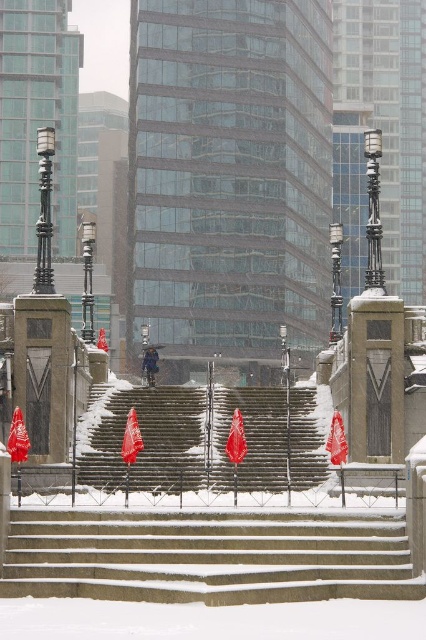
Does point (114, 484) lie in front of point (155, 364)?

Yes, point (114, 484) is closer to viewer.

Which of these two, snow-covered stone stairs at center or white snowsuit at center, stands shorter?

white snowsuit at center

Who is more forward, [169,458] or [146,358]?

Positioned in front is point [169,458].

The height and width of the screenshot is (640, 426). I want to click on snow-covered stone stairs at center, so click(x=149, y=440).

Who is lower down, snow-covered concrete stairs at lower center or white snowsuit at center?

Positioned lower is snow-covered concrete stairs at lower center.

Between point (336, 529) and point (146, 362), which one is positioned in front?

Point (336, 529)

Identify the location of snow-covered concrete stairs at lower center. This screenshot has width=426, height=640. (207, 556).

Is snow-covered concrete stairs at lower center above snow-covered stone stairs at center?

No.

Between point (270, 532) and point (250, 468), which one is positioned behind?

The point (250, 468) is behind.

Where is `snow-covered concrete stairs at lower center`? The width and height of the screenshot is (426, 640). snow-covered concrete stairs at lower center is located at coordinates (207, 556).